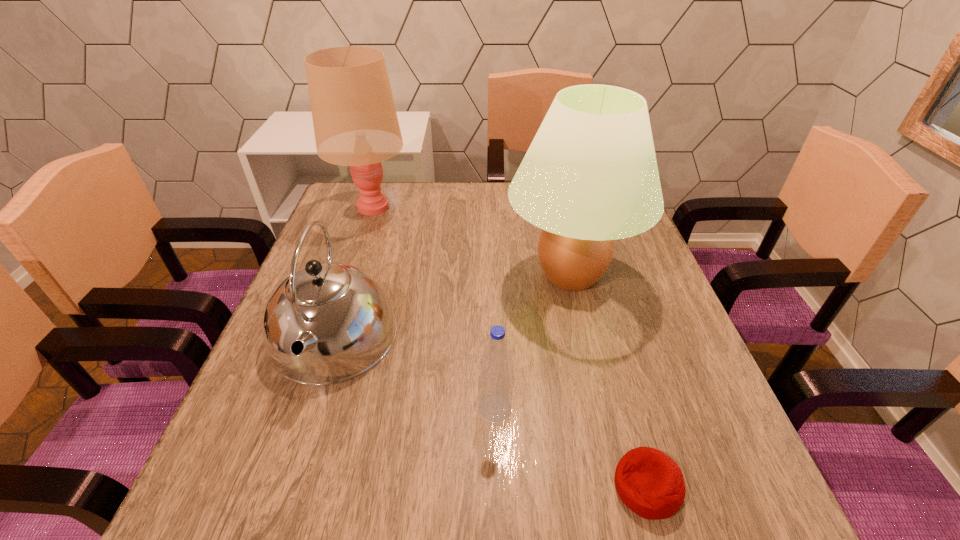
Locate an element on the screen. The image size is (960, 540). vacant space located 0.110m on the shade of the right lampshade is located at coordinates (459, 275).

Where is `vacant space situated 0.180m on the front of the farther lampshade`? The height and width of the screenshot is (540, 960). vacant space situated 0.180m on the front of the farther lampshade is located at coordinates (349, 270).

Locate an element on the screen. vacant space located from the spout of the third tallest object is located at coordinates (295, 455).

What are the coordinates of `vacant region located 0.230m on the back of the third object from right to left` in the screenshot? It's located at (492, 307).

Find the location of a particular element. The width and height of the screenshot is (960, 540). free space located 0.330m on the seat area of the nearest object is located at coordinates (405, 487).

The image size is (960, 540). Identify the location of vacant point located on the seat area of the nearest object. (468, 487).

The height and width of the screenshot is (540, 960). I want to click on vacant region located on the seat area of the nearest object, so click(x=544, y=487).

Where is `object at the far edge`? The width and height of the screenshot is (960, 540). object at the far edge is located at coordinates (355, 122).

What are the coordinates of `object that is at the near edge` in the screenshot? It's located at 650,483.

Locate an element on the screen. lampshade situated at the left edge is located at coordinates (355, 122).